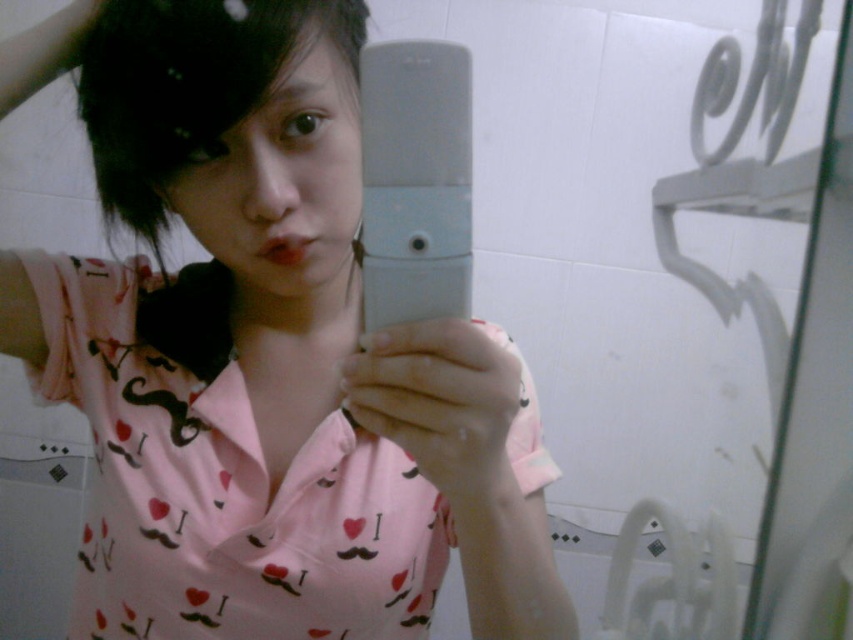
Is pink fabric shirt at center taller than black matte hair at upper left?

Yes, pink fabric shirt at center is taller than black matte hair at upper left.

Between pink fabric shirt at center and black matte hair at upper left, which one is positioned higher?

black matte hair at upper left is above.

Does point (123, 188) lie behind point (123, 10)?

That is True.

Image resolution: width=853 pixels, height=640 pixels. What are the coordinates of `pink fabric shirt at center` in the screenshot? It's located at (264, 353).

Which of these two, black matte hair at upper left or gray matte smartphone at center, stands taller?

black matte hair at upper left

The image size is (853, 640). Describe the element at coordinates (186, 88) in the screenshot. I see `black matte hair at upper left` at that location.

At what (x,y) coordinates should I click in order to perform the action: click on black matte hair at upper left. Please return your answer as a coordinate pair (x, y). The image size is (853, 640). Looking at the image, I should click on (186, 88).

Does pink fabric shirt at center have a greater width compared to gray matte smartphone at center?

Correct, the width of pink fabric shirt at center exceeds that of gray matte smartphone at center.

Is pink fabric shirt at center bigger than gray matte smartphone at center?

Yes, pink fabric shirt at center is bigger than gray matte smartphone at center.

Where is `pink fabric shirt at center`? This screenshot has height=640, width=853. pink fabric shirt at center is located at coordinates (264, 353).